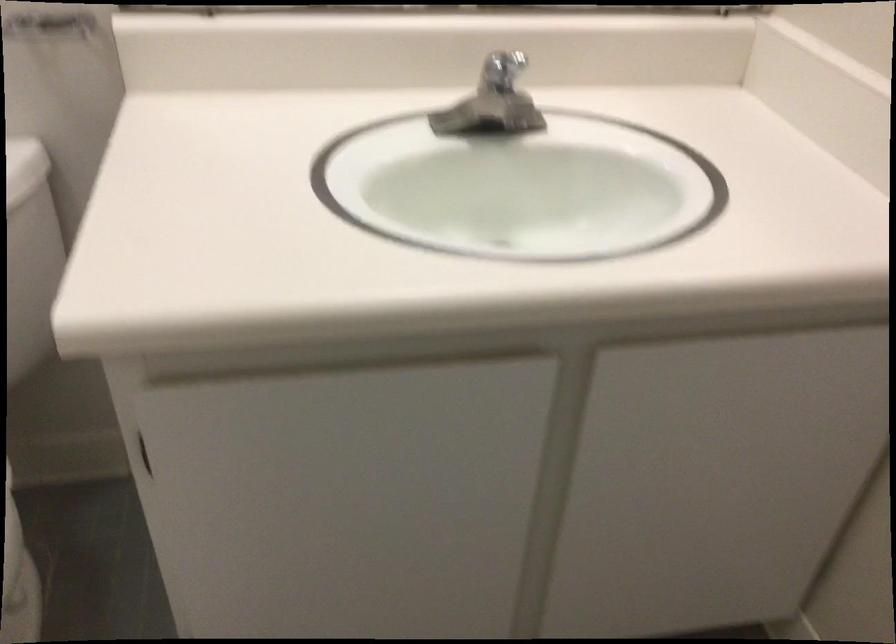
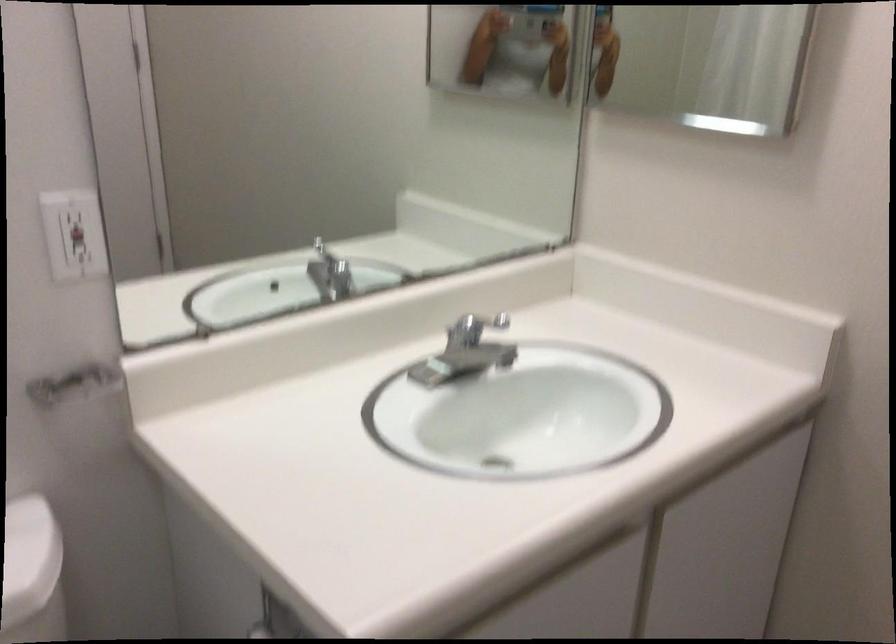
Find the pixel in the second image that matches point (501, 76) in the first image.

(474, 328)